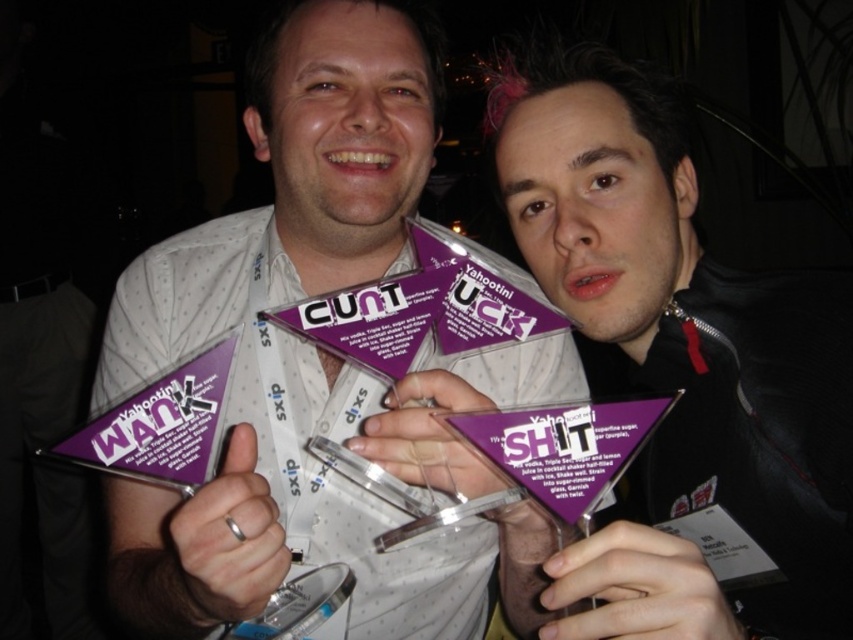
Does purple glossy triangle at center have a smaller size compared to purple paper award at center?

No, purple glossy triangle at center is not smaller than purple paper award at center.

Is point (488, 396) closer to camera compared to point (795, 369)?

That is False.

Which is in front, point (532, 372) or point (706, 433)?

Point (706, 433) is more forward.

Where is `purple glossy triangle at center`? purple glossy triangle at center is located at coordinates (315, 516).